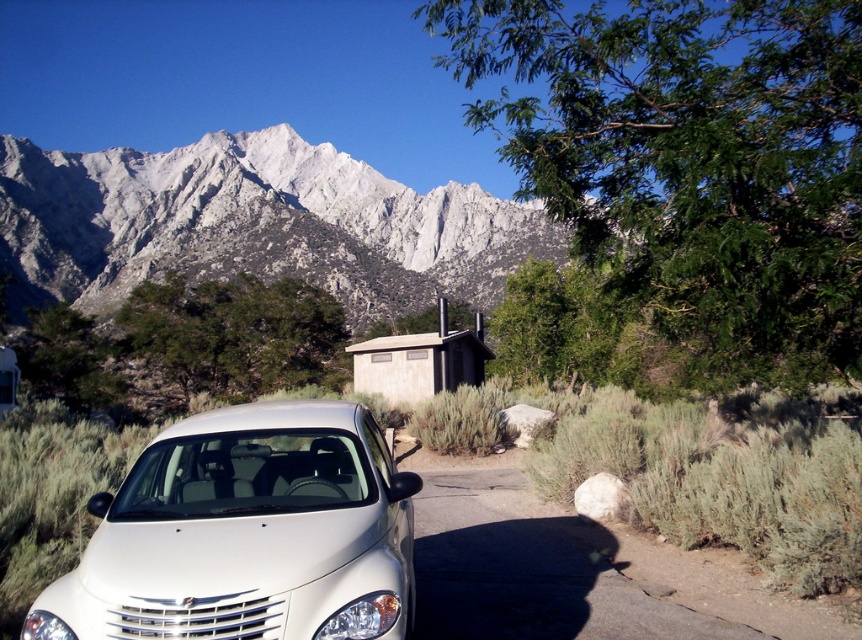
Can you confirm if snowy granite mountain range at upper left is positioned below beige wood cabin at center?

No.

Between point (240, 209) and point (423, 400), which one is positioned behind?

The point (240, 209) is more distant.

You are a GUI agent. You are given a task and a screenshot of the screen. Output one action in this format:
    pyautogui.click(x=<x>, y=<y>)
    Task: Click on the snowy granite mountain range at upper left
    The width and height of the screenshot is (862, 640).
    Given the screenshot: What is the action you would take?
    tap(254, 225)

Does snowy granite mountain range at upper left appear on the right side of white glossy car at lower left?

No, snowy granite mountain range at upper left is not to the right of white glossy car at lower left.

Between snowy granite mountain range at upper left and white glossy car at lower left, which one appears on the right side from the viewer's perspective?

Positioned to the right is white glossy car at lower left.

Does point (188, 166) come closer to viewer compared to point (241, 515)?

No, (188, 166) is behind (241, 515).

At what (x,y) coordinates should I click in order to perform the action: click on snowy granite mountain range at upper left. Please return your answer as a coordinate pair (x, y). The width and height of the screenshot is (862, 640). Looking at the image, I should click on (254, 225).

Is white glossy car at lower left closer to camera compared to beige wood cabin at center?

Yes.

Who is positioned more to the left, white glossy car at lower left or beige wood cabin at center?

beige wood cabin at center is more to the left.

Is point (132, 516) farther from viewer compared to point (467, 378)?

No, (132, 516) is closer to viewer.

You are a GUI agent. You are given a task and a screenshot of the screen. Output one action in this format:
    pyautogui.click(x=<x>, y=<y>)
    Task: Click on the white glossy car at lower left
    This screenshot has width=862, height=640.
    Given the screenshot: What is the action you would take?
    pyautogui.click(x=247, y=532)